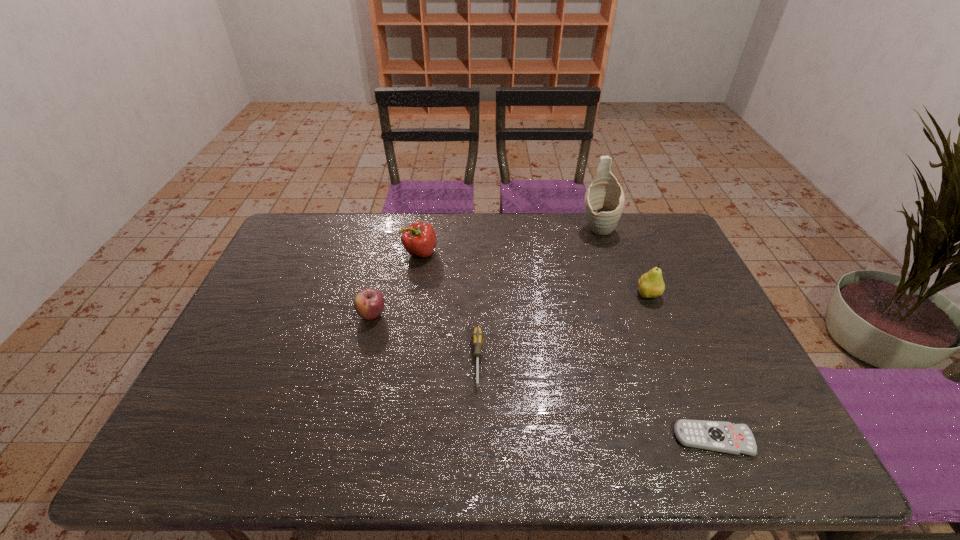
Where is `pear that is at the right edge`? This screenshot has width=960, height=540. pear that is at the right edge is located at coordinates (651, 284).

Locate an element on the screen. remote control present at the right edge is located at coordinates (718, 436).

Locate an element on the screen. object that is at the near right corner is located at coordinates (718, 436).

This screenshot has height=540, width=960. Identify the location of vacant space at the far edge of the desktop. (478, 236).

This screenshot has height=540, width=960. In the image, there is a desktop. Identify the location of free space at the left edge. (252, 359).

You are a GUI agent. You are given a task and a screenshot of the screen. Output one action in this format:
    pyautogui.click(x=<x>, y=<y>)
    Task: Click on the vacant space at the right edge of the desktop
    
    Given the screenshot: What is the action you would take?
    pyautogui.click(x=724, y=384)

Where is `vacant space at the far left corner of the desktop`? This screenshot has height=540, width=960. vacant space at the far left corner of the desktop is located at coordinates [x=292, y=245].

In the image, there is a desktop. Find the location of `vacant space at the near left corner`. vacant space at the near left corner is located at coordinates (220, 462).

Locate an element on the screen. The width and height of the screenshot is (960, 540). free location at the far right corner is located at coordinates (645, 218).

The width and height of the screenshot is (960, 540). I want to click on vacant space that is in between the farthest object and the screwdriver, so click(x=538, y=294).